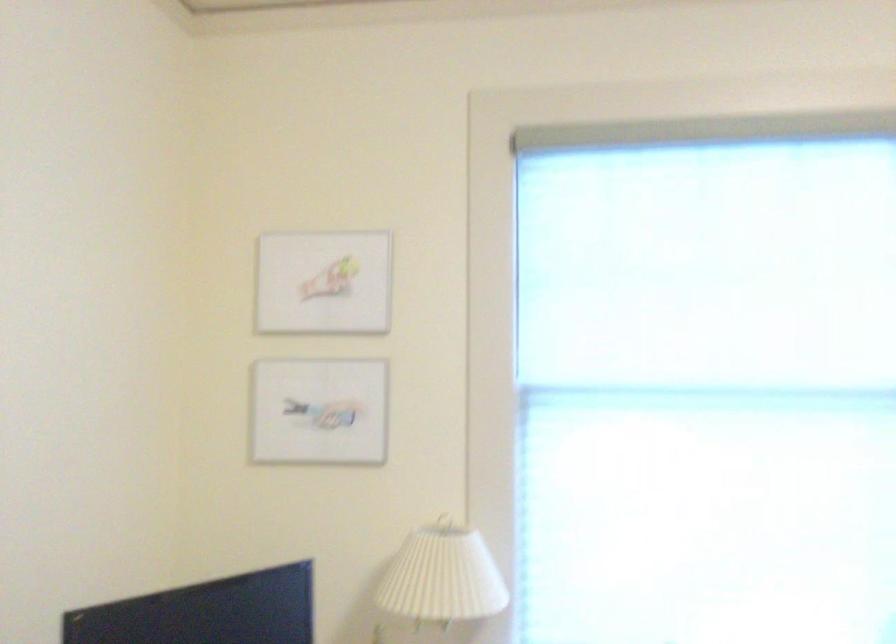
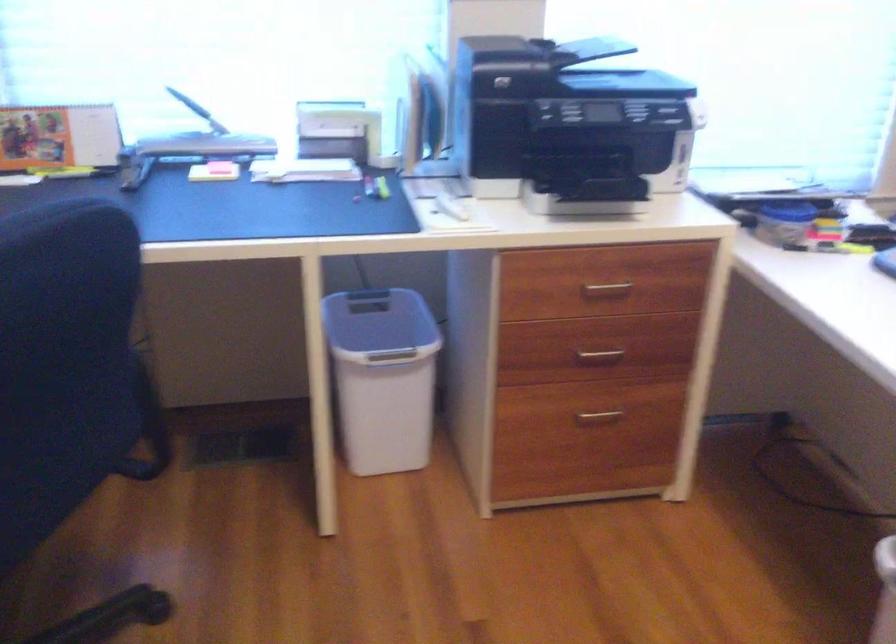
The first image is from the beginning of the video and the second image is from the end. How did the camera likely rotate when shooting the video?

The camera rotated toward right-down.